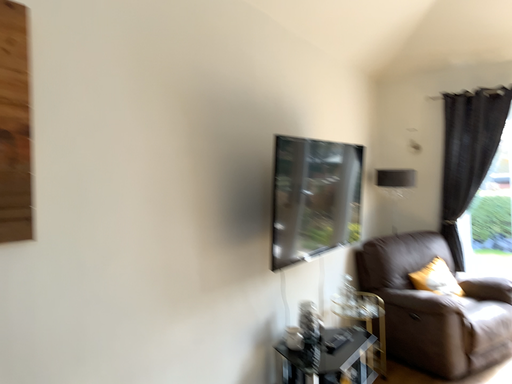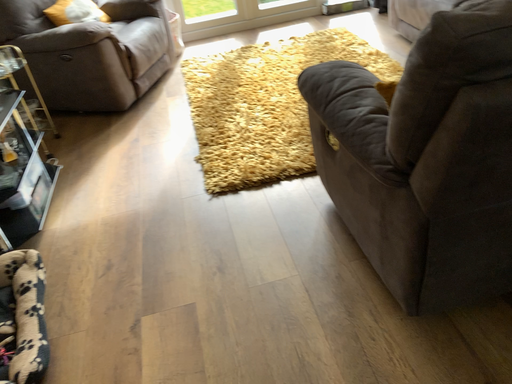
Question: How did the camera likely rotate when shooting the video?

Choices:
 (A) rotated right
 (B) rotated left

Answer: (A)